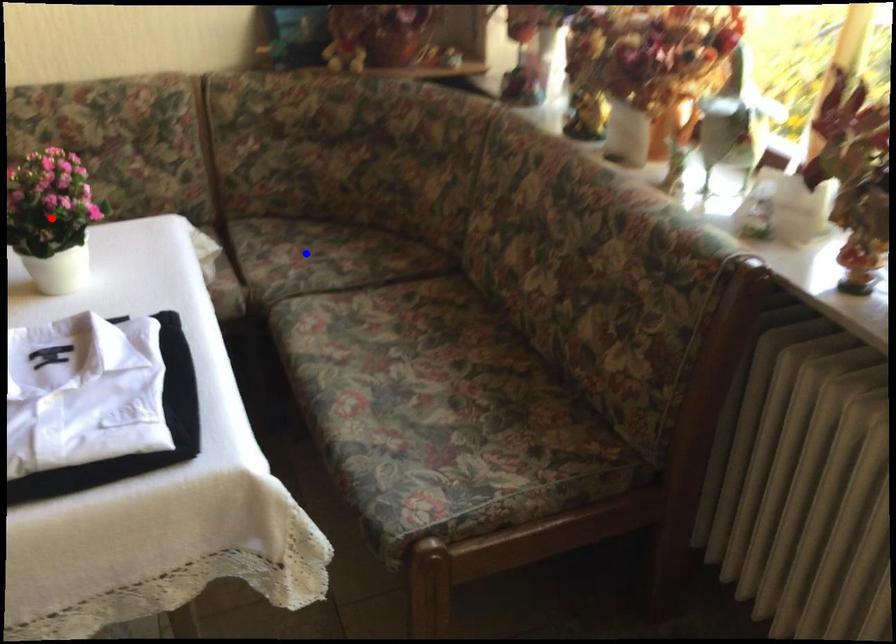
Question: In the image, two points are highlighted. Which point is nearer to the camera? Reply with the corresponding letter.

Choices:
 (A) blue point
 (B) red point

Answer: (B)